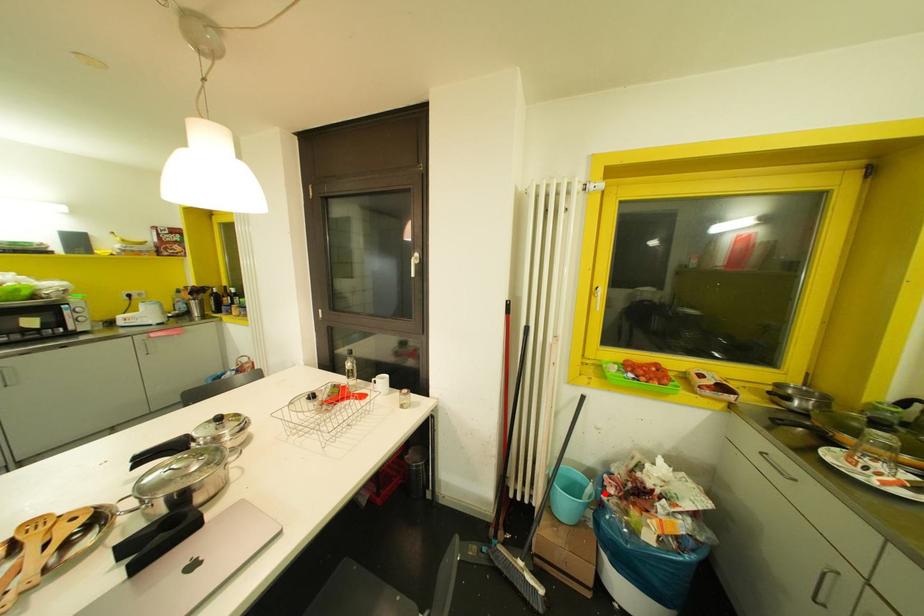
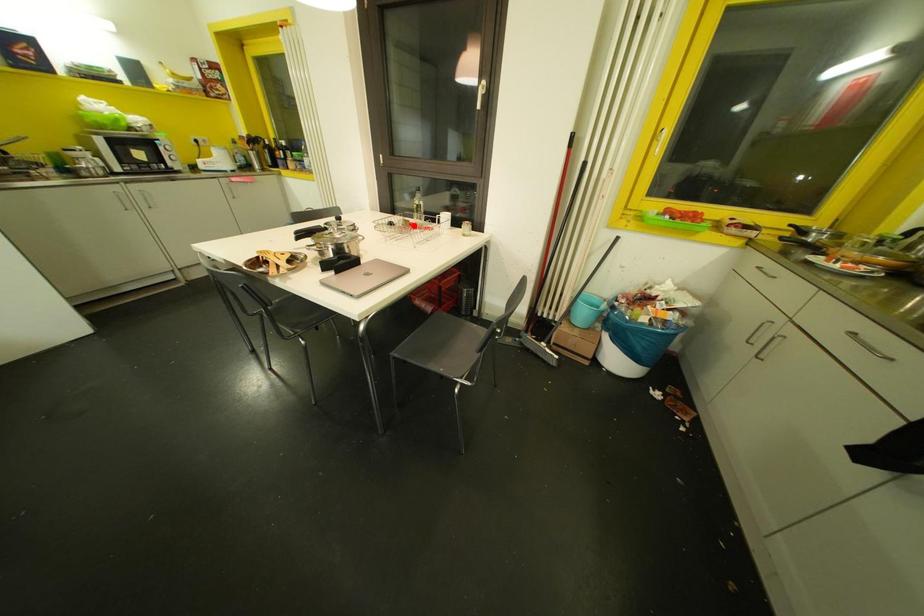
I am providing you with two images of the same scene from different viewpoints. A red point is marked on the first image and another point is marked on the second image. Is the red point in image1 aligned with the point shown in image2?

No